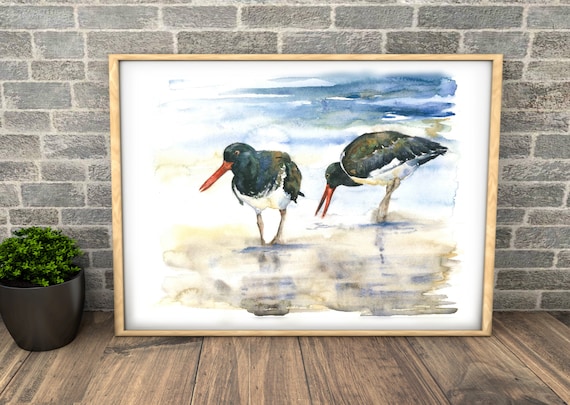
The height and width of the screenshot is (405, 570). I want to click on plant, so click(32, 258).